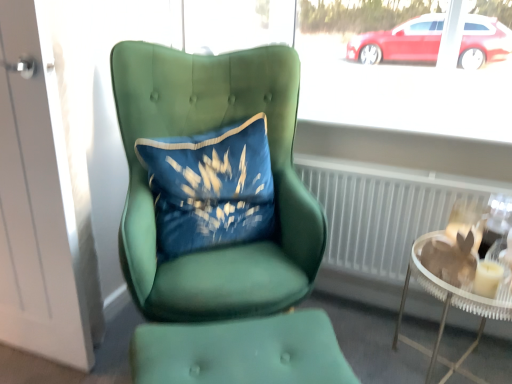
This screenshot has width=512, height=384. What are the coordinates of `vacant area that lies between white matte door at left and velvet green chair at center` in the screenshot? It's located at (111, 347).